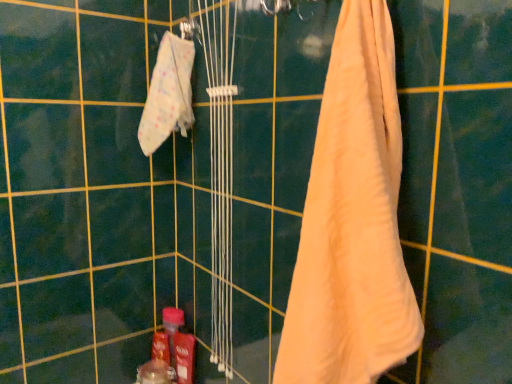
Question: Can you confirm if translucent plastic bottle at lower center is positioned to the left of white fabric towel at upper left, which is the second towel from front to back?

Choices:
 (A) yes
 (B) no

Answer: (A)

Question: Considering the relative sizes of translucent plastic bottle at lower center and white fabric towel at upper left, marked as the 1th towel in a back-to-front arrangement, in the image provided, is translucent plastic bottle at lower center bigger than white fabric towel at upper left, marked as the 1th towel in a back-to-front arrangement,?

Choices:
 (A) yes
 (B) no

Answer: (B)

Question: Does translucent plastic bottle at lower center turn towards white fabric towel at upper left, marked as the 1th towel in a back-to-front arrangement?

Choices:
 (A) yes
 (B) no

Answer: (B)

Question: Does translucent plastic bottle at lower center have a greater width compared to white fabric towel at upper left, positioned as the first towel in left-to-right order?

Choices:
 (A) yes
 (B) no

Answer: (B)

Question: Considering the relative sizes of translucent plastic bottle at lower center and white fabric towel at upper left, which is the second towel from front to back, in the image provided, is translucent plastic bottle at lower center taller than white fabric towel at upper left, which is the second towel from front to back,?

Choices:
 (A) yes
 (B) no

Answer: (B)

Question: Does point (180, 317) appear closer or farther from the camera than point (288, 357)?

Choices:
 (A) farther
 (B) closer

Answer: (A)

Question: Based on their sizes in the image, would you say translucent plastic bottle at lower center is bigger or smaller than beige cotton towel at right, which is the second towel in back-to-front order?

Choices:
 (A) big
 (B) small

Answer: (B)

Question: From a real-world perspective, is translucent plastic bottle at lower center positioned above or below beige cotton towel at right, which is the 2th towel from left to right?

Choices:
 (A) above
 (B) below

Answer: (B)

Question: Considering the positions of translucent plastic bottle at lower center and beige cotton towel at right, acting as the 1th towel starting from the front, in the image, is translucent plastic bottle at lower center wider or thinner than beige cotton towel at right, acting as the 1th towel starting from the front,?

Choices:
 (A) wide
 (B) thin

Answer: (B)

Question: Based on their positions, is white fabric towel at upper left, positioned as the first towel in left-to-right order, located to the left or right of translucent plastic bottle at lower center?

Choices:
 (A) left
 (B) right

Answer: (B)

Question: From the image's perspective, is white fabric towel at upper left, marked as the 1th towel in a back-to-front arrangement, positioned above or below translucent plastic bottle at lower center?

Choices:
 (A) above
 (B) below

Answer: (A)

Question: Is white fabric towel at upper left, which is the second towel from front to back, in front of or behind translucent plastic bottle at lower center in the image?

Choices:
 (A) behind
 (B) front

Answer: (B)

Question: From their relative heights in the image, would you say white fabric towel at upper left, which is the second towel from front to back, is taller or shorter than translucent plastic bottle at lower center?

Choices:
 (A) short
 (B) tall

Answer: (B)

Question: In the image, is beige cotton towel at right, which is the 2th towel from left to right, on the left side or the right side of translucent plastic bottle at lower center?

Choices:
 (A) right
 (B) left

Answer: (A)

Question: Relative to translucent plastic bottle at lower center, is beige cotton towel at right, the 1th towel positioned from the right, in front or behind?

Choices:
 (A) behind
 (B) front

Answer: (B)